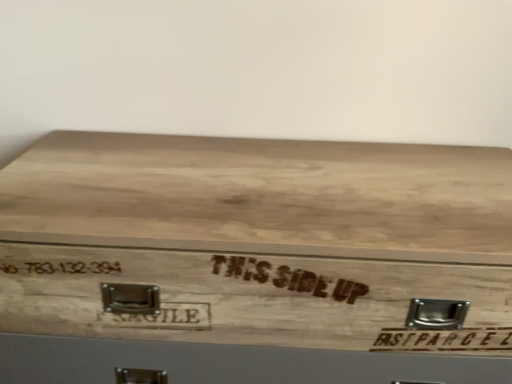
Find the location of a particular element. The width and height of the screenshot is (512, 384). empty space that is ontop of natural wood box at center (from a real-world perspective) is located at coordinates (263, 176).